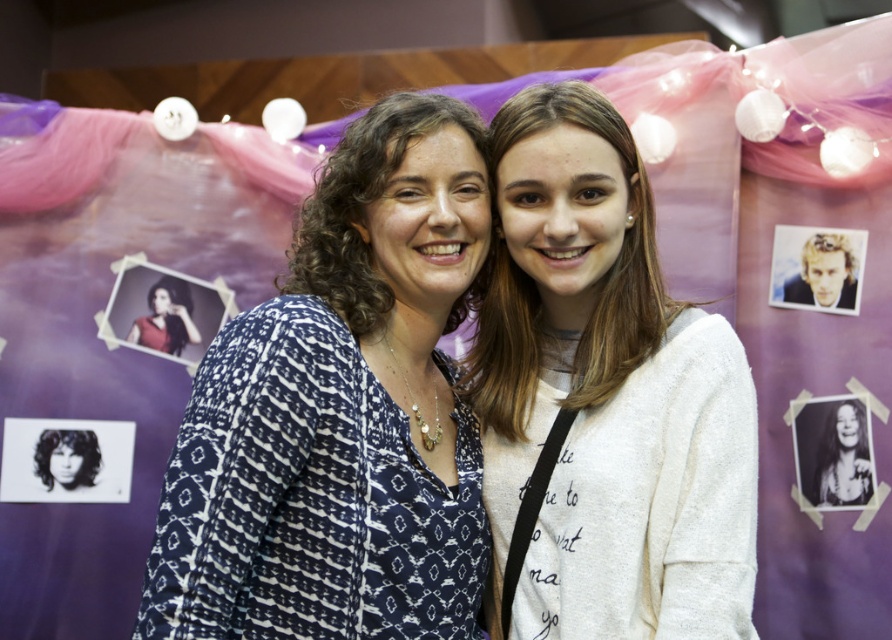
Question: Which object appears closest to the camera in this image?

Choices:
 (A) matte red blouse at center
 (B) blue printed blouse at center

Answer: (B)

Question: Is blue printed blouse at center bigger than black glossy photo at center?

Choices:
 (A) no
 (B) yes

Answer: (B)

Question: Which of the following is the farthest from the observer?

Choices:
 (A) (582, 248)
 (B) (864, 472)

Answer: (B)

Question: Among these objects, which one is farthest from the camera?

Choices:
 (A) matte red blouse at center
 (B) blue printed blouse at center

Answer: (A)

Question: Is black glossy photo at center above matte red blouse at center?

Choices:
 (A) no
 (B) yes

Answer: (A)

Question: Is blue printed blouse at center below white soft sweater at center?

Choices:
 (A) no
 (B) yes

Answer: (B)